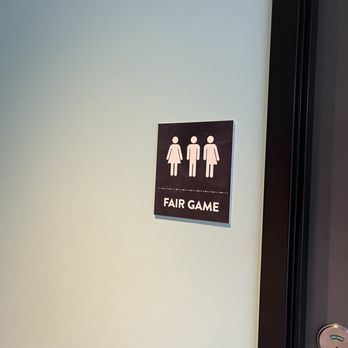
Where is `wall`? The width and height of the screenshot is (348, 348). wall is located at coordinates (88, 120).